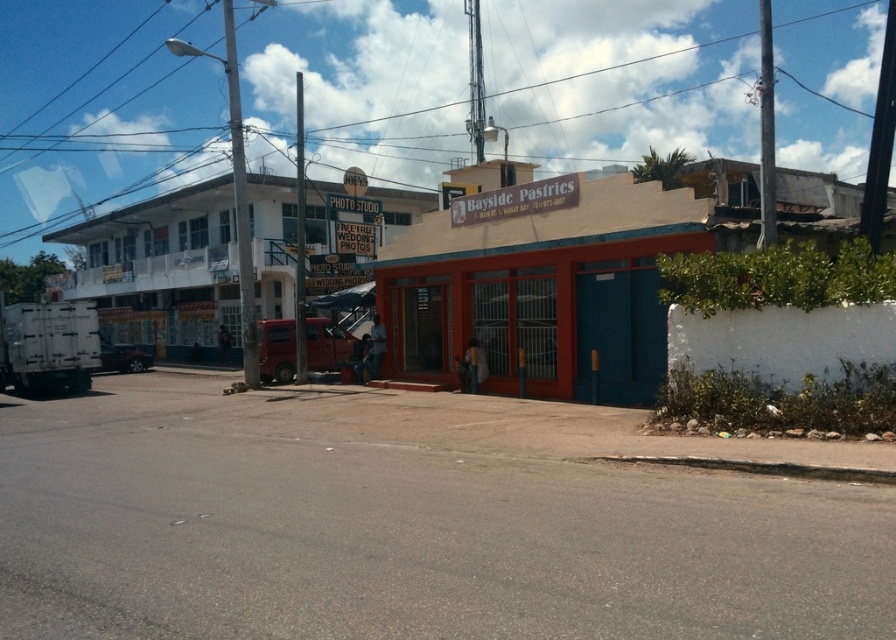
In the scene shown: Is matte orange storefront at center positioned at the back of white matte building at upper left?

No.

Can you confirm if matte orange storefront at center is positioned below white matte building at upper left?

Correct, matte orange storefront at center is located below white matte building at upper left.

Which is in front, point (421, 275) or point (312, 284)?

Positioned in front is point (421, 275).

This screenshot has width=896, height=640. Find the location of `matte orange storefront at center`. matte orange storefront at center is located at coordinates (541, 289).

Does white matte building at center have a greater width compared to white matte building at upper left?

Correct, the width of white matte building at center exceeds that of white matte building at upper left.

The width and height of the screenshot is (896, 640). What do you see at coordinates (556, 278) in the screenshot? I see `white matte building at center` at bounding box center [556, 278].

Find the location of a particular element. white matte building at center is located at coordinates (556, 278).

Which is below, white matte building at center or matte orange storefront at center?

matte orange storefront at center is lower down.

Which of these two, white matte building at center or matte orange storefront at center, stands taller?

white matte building at center is taller.

Describe the element at coordinates (556, 278) in the screenshot. I see `white matte building at center` at that location.

Where is `white matte building at center`? The height and width of the screenshot is (640, 896). white matte building at center is located at coordinates click(x=556, y=278).